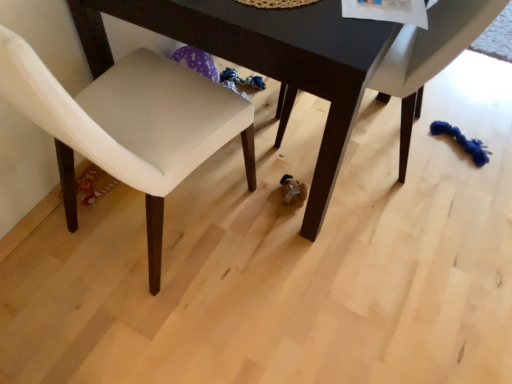
I want to click on white fabric chair at lower right, which is the 1th chair in right-to-left order, so pos(429,57).

You are a GUI agent. You are given a task and a screenshot of the screen. Output one action in this format:
    pyautogui.click(x=<x>, y=<y>)
    Task: Click on the white fabric chair at lower right, which is the 1th chair in right-to-left order
    The image size is (512, 384).
    Given the screenshot: What is the action you would take?
    pyautogui.click(x=429, y=57)

Is white leather chair at lower left, the 2th chair in the right-to-left sequence, smaller than white fabric chair at lower right, which is the 1th chair in right-to-left order?

No.

Relative to white fabric chair at lower right, which is counted as the 2th chair, starting from the left, is white leather chair at lower left, the 2th chair in the right-to-left sequence, in front or behind?

Clearly, white leather chair at lower left, the 2th chair in the right-to-left sequence, is in front of white fabric chair at lower right, which is counted as the 2th chair, starting from the left.

From the picture: Would you consider white leather chair at lower left, the 2th chair in the right-to-left sequence, to be distant from white fabric chair at lower right, which is counted as the 2th chair, starting from the left?

white leather chair at lower left, the 2th chair in the right-to-left sequence, is actually quite close to white fabric chair at lower right, which is counted as the 2th chair, starting from the left.

Locate an element on the screen. The image size is (512, 384). table lying on the left of white fabric chair at lower right, which is counted as the 2th chair, starting from the left is located at coordinates (265, 59).

Is dark wood table at center far away from white fabric chair at lower right, which is counted as the 2th chair, starting from the left?

No.

Which of these two, dark wood table at center or white fabric chair at lower right, which is the 1th chair in right-to-left order, is wider?

With larger width is dark wood table at center.

Considering the sizes of objects dark wood table at center and white fabric chair at lower right, which is the 1th chair in right-to-left order, in the image provided, who is taller, dark wood table at center or white fabric chair at lower right, which is the 1th chair in right-to-left order,?

dark wood table at center.

Based on the photo, is white fabric chair at lower right, which is counted as the 2th chair, starting from the left, at the left side of white leather chair at lower left, the 2th chair in the right-to-left sequence?

In fact, white fabric chair at lower right, which is counted as the 2th chair, starting from the left, is to the right of white leather chair at lower left, the 2th chair in the right-to-left sequence.

From a real-world perspective, does white fabric chair at lower right, which is the 1th chair in right-to-left order, sit lower than white leather chair at lower left, which is counted as the first chair, starting from the left?

Correct, in the physical world, white fabric chair at lower right, which is the 1th chair in right-to-left order, is lower than white leather chair at lower left, which is counted as the first chair, starting from the left.

Between white fabric chair at lower right, which is the 1th chair in right-to-left order, and white leather chair at lower left, which is counted as the first chair, starting from the left, which one has larger size?

Bigger between the two is white leather chair at lower left, which is counted as the first chair, starting from the left.

The image size is (512, 384). In order to click on table above the white leather chair at lower left, the 2th chair in the right-to-left sequence (from the image's perspective) in this screenshot , I will do `click(265, 59)`.

Considering the relative sizes of white leather chair at lower left, the 2th chair in the right-to-left sequence, and dark wood table at center in the image provided, is white leather chair at lower left, the 2th chair in the right-to-left sequence, taller than dark wood table at center?

Yes, white leather chair at lower left, the 2th chair in the right-to-left sequence, is taller than dark wood table at center.

Is dark wood table at center inside white leather chair at lower left, which is counted as the first chair, starting from the left?

No, dark wood table at center is not a part of white leather chair at lower left, which is counted as the first chair, starting from the left.

Is white leather chair at lower left, the 2th chair in the right-to-left sequence, positioned with its back to dark wood table at center?

That's not correct — white leather chair at lower left, the 2th chair in the right-to-left sequence, is not looking away from dark wood table at center.

Would you say dark wood table at center is a long distance from white leather chair at lower left, which is counted as the first chair, starting from the left?

No, dark wood table at center is not far away from white leather chair at lower left, which is counted as the first chair, starting from the left.

From the image's perspective, which object appears higher, dark wood table at center or white leather chair at lower left, which is counted as the first chair, starting from the left?

dark wood table at center.

Considering the sizes of objects dark wood table at center and white leather chair at lower left, the 2th chair in the right-to-left sequence, in the image provided, who is thinner, dark wood table at center or white leather chair at lower left, the 2th chair in the right-to-left sequence,?

Thinner between the two is white leather chair at lower left, the 2th chair in the right-to-left sequence.

Which object is wider, white fabric chair at lower right, which is counted as the 2th chair, starting from the left, or dark wood table at center?

dark wood table at center is wider.

From the image's perspective, which object appears higher, white fabric chair at lower right, which is counted as the 2th chair, starting from the left, or dark wood table at center?

dark wood table at center appears higher in the image.

From a real-world perspective, which is physically below, white fabric chair at lower right, which is the 1th chair in right-to-left order, or dark wood table at center?

white fabric chair at lower right, which is the 1th chair in right-to-left order, from a real-world perspective.

Looking at this image, is white fabric chair at lower right, which is counted as the 2th chair, starting from the left, spatially inside dark wood table at center, or outside of it?

white fabric chair at lower right, which is counted as the 2th chair, starting from the left, is spatially positioned inside dark wood table at center.

Identify the location of chair located underneath the white leather chair at lower left, the 2th chair in the right-to-left sequence (from a real-world perspective). (429, 57).

Locate an element on the screen. This screenshot has height=384, width=512. the 1st chair below the dark wood table at center (from the image's perspective) is located at coordinates (429, 57).

From the picture: Looking at the image, which one is located further to white leather chair at lower left, the 2th chair in the right-to-left sequence, dark wood table at center or white fabric chair at lower right, which is counted as the 2th chair, starting from the left?

white fabric chair at lower right, which is counted as the 2th chair, starting from the left.

Based on their spatial positions, is white fabric chair at lower right, which is the 1th chair in right-to-left order, or dark wood table at center closer to white leather chair at lower left, which is counted as the first chair, starting from the left?

The object closer to white leather chair at lower left, which is counted as the first chair, starting from the left, is dark wood table at center.

Considering their positions, is dark wood table at center positioned closer to white fabric chair at lower right, which is counted as the 2th chair, starting from the left, than white leather chair at lower left, which is counted as the first chair, starting from the left?

dark wood table at center.

Consider the image. Looking at the image, which one is located further to white fabric chair at lower right, which is counted as the 2th chair, starting from the left, white leather chair at lower left, the 2th chair in the right-to-left sequence, or dark wood table at center?

Among the two, white leather chair at lower left, the 2th chair in the right-to-left sequence, is located further to white fabric chair at lower right, which is counted as the 2th chair, starting from the left.

Looking at the image, which one is located further to dark wood table at center, white leather chair at lower left, which is counted as the first chair, starting from the left, or white fabric chair at lower right, which is counted as the 2th chair, starting from the left?

Based on the image, white fabric chair at lower right, which is counted as the 2th chair, starting from the left, appears to be further to dark wood table at center.

Looking at this image, estimate the real-world distances between objects in this image. Which object is closer to dark wood table at center, white fabric chair at lower right, which is counted as the 2th chair, starting from the left, or white leather chair at lower left, the 2th chair in the right-to-left sequence?

Among the two, white leather chair at lower left, the 2th chair in the right-to-left sequence, is located nearer to dark wood table at center.

Image resolution: width=512 pixels, height=384 pixels. I want to click on table between white leather chair at lower left, which is counted as the first chair, starting from the left, and white fabric chair at lower right, which is the 1th chair in right-to-left order, in the horizontal direction, so click(265, 59).